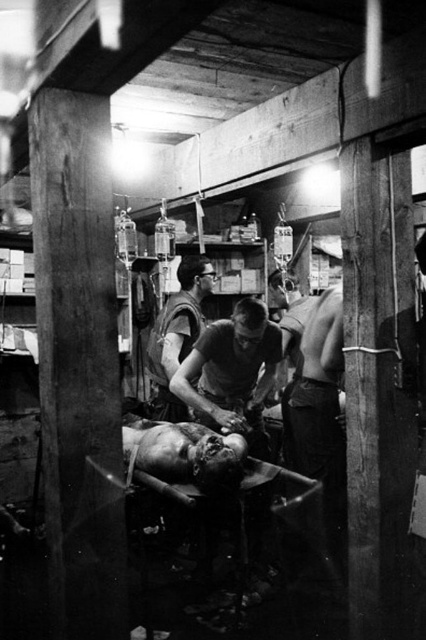
Question: Which object appears farthest from the camera in this image?

Choices:
 (A) matte black vest at center
 (B) smooth skin man at center

Answer: (A)

Question: Among these points, which one is nearest to the camera?

Choices:
 (A) (334, 440)
 (B) (166, 321)

Answer: (A)

Question: Does smooth skin man at center lie behind matte black vest at center?

Choices:
 (A) no
 (B) yes

Answer: (A)

Question: Can you confirm if smooth skin man at center is positioned below matte black vest at center?

Choices:
 (A) yes
 (B) no

Answer: (A)

Question: Among these points, which one is farthest from the camera?

Choices:
 (A) (342, 476)
 (B) (196, 264)

Answer: (B)

Question: Can you confirm if smooth skin man at center is positioned above matte black vest at center?

Choices:
 (A) no
 (B) yes

Answer: (A)